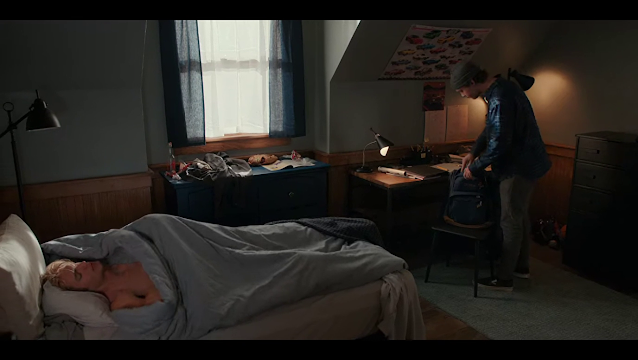
Locate an element on the screen. The image size is (638, 360). desk is located at coordinates (404, 221).